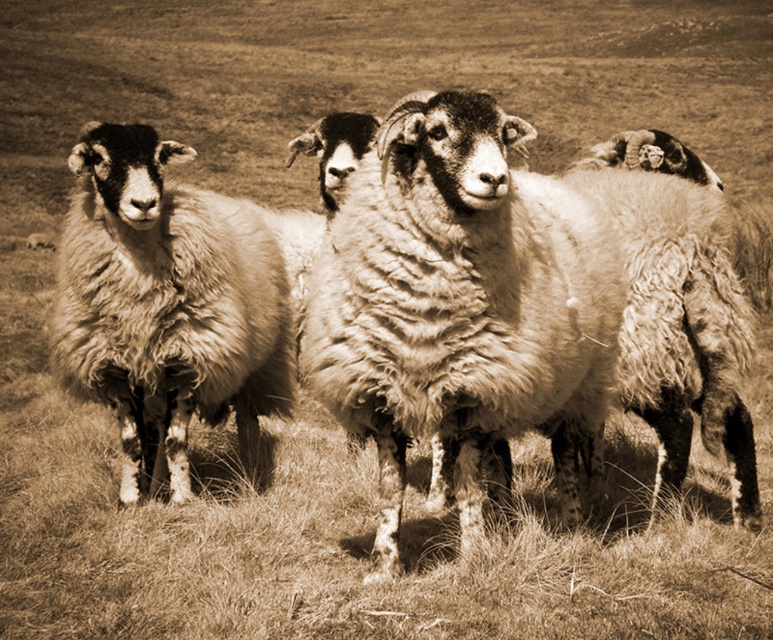
Question: Is fuzzy woolly sheep at center wider than fuzzy woolly sheep at left?

Choices:
 (A) yes
 (B) no

Answer: (A)

Question: Among these points, which one is farthest from the camera?

Choices:
 (A) (58, 320)
 (B) (359, 188)

Answer: (A)

Question: Can you confirm if fuzzy woolly sheep at center is smaller than fuzzy woolly sheep at left?

Choices:
 (A) no
 (B) yes

Answer: (A)

Question: Where is fuzzy woolly sheep at center located in relation to fuzzy woolly sheep at left in the image?

Choices:
 (A) left
 (B) right

Answer: (B)

Question: Among these points, which one is farthest from the camera?

Choices:
 (A) (520, 266)
 (B) (142, 195)

Answer: (B)